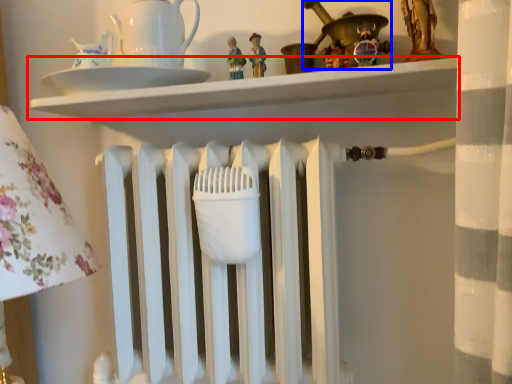
Question: Which object appears closest to the camera in this image, shelf (highlighted by a red box) or toy (highlighted by a blue box)?

Choices:
 (A) shelf
 (B) toy

Answer: (A)